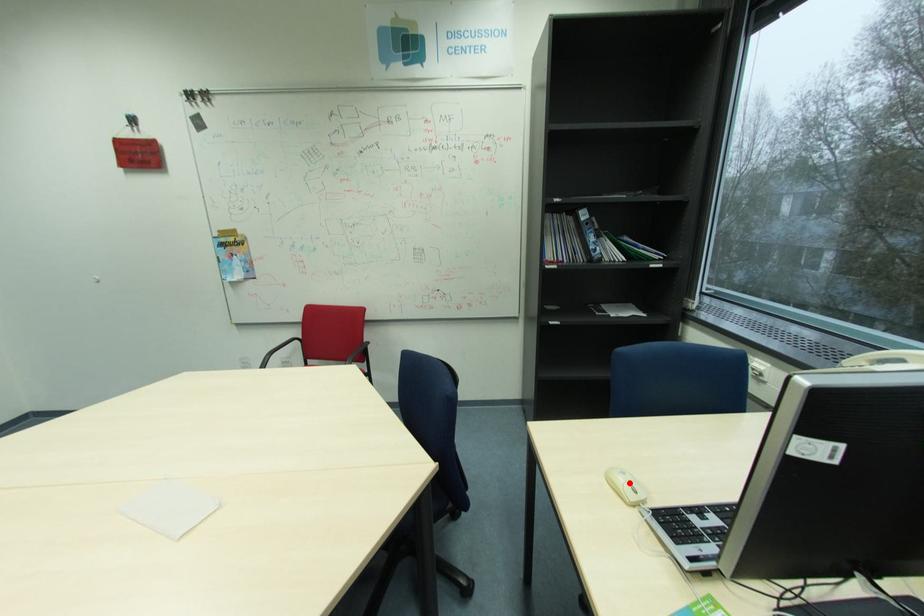
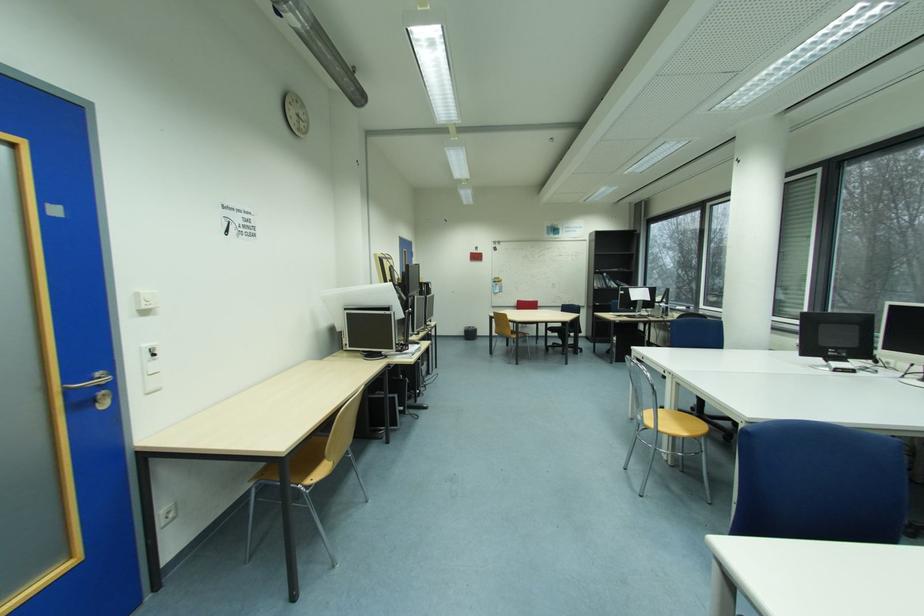
Question: I am providing you with two images of the same scene from different viewpoints. A red point is marked on the first image. At the location where the point appears in image 1, is it still visible in image 2?

Choices:
 (A) Yes
 (B) No

Answer: (B)